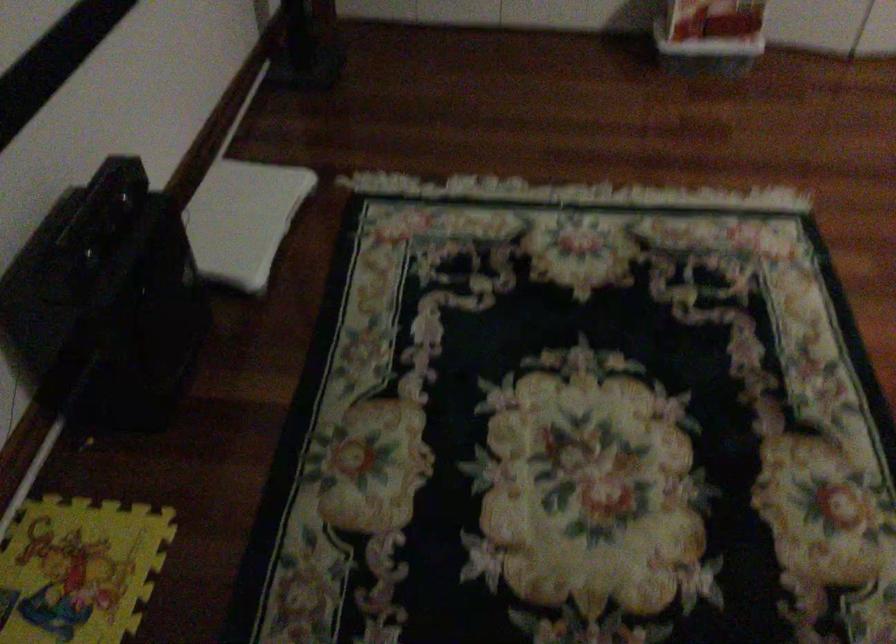
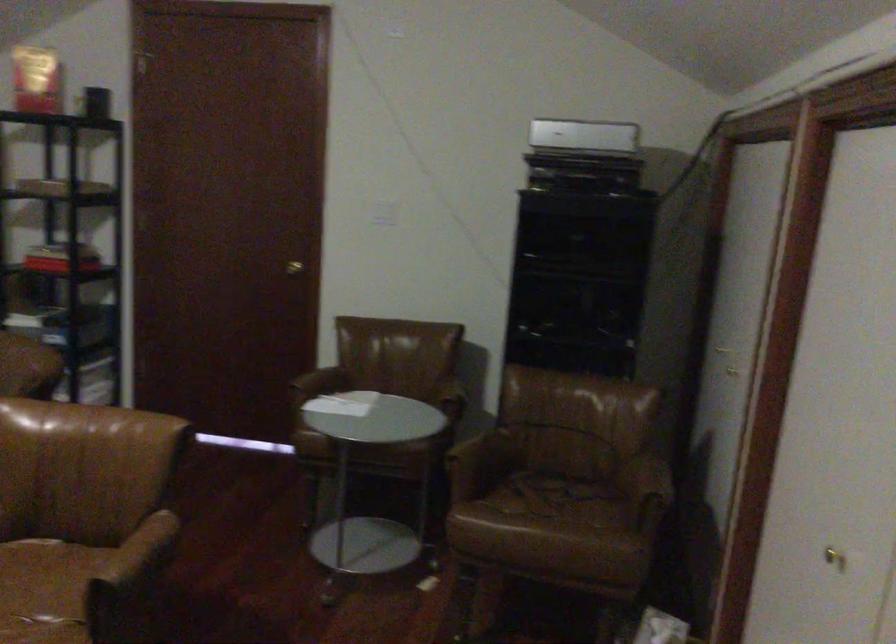
Question: The camera is either moving clockwise (left) or counter-clockwise (right) around the object. The first image is from the beginning of the video and the second image is from the end. Is the camera moving left or right when shooting the video?

Choices:
 (A) Left
 (B) Right

Answer: (A)